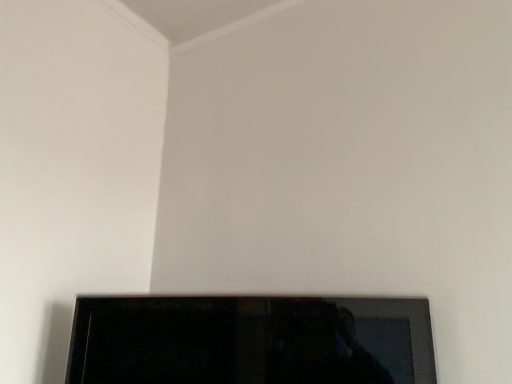
Question: Should I look upward or downward to see black glossy tv at bottom?

Choices:
 (A) up
 (B) down

Answer: (B)